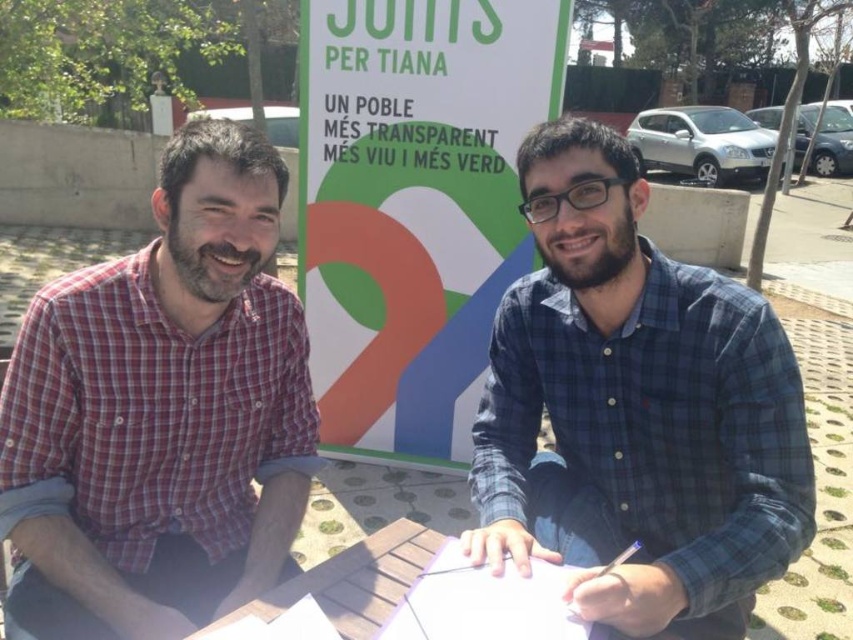
Which of these two, plaid cotton shirt at left or blue plaid shirt at center, stands taller?

Standing taller between the two is blue plaid shirt at center.

Is plaid cotton shirt at left thinner than blue plaid shirt at center?

Correct, plaid cotton shirt at left's width is less than blue plaid shirt at center's.

Does point (274, 307) come farther from viewer compared to point (764, 436)?

Yes, it is.

Identify the location of plaid cotton shirt at left. The height and width of the screenshot is (640, 853). (161, 413).

Does plaid cotton shirt at left have a lesser height compared to wooden picnic table at center?

In fact, plaid cotton shirt at left may be taller than wooden picnic table at center.

Does plaid cotton shirt at left have a larger size compared to wooden picnic table at center?

Indeed, plaid cotton shirt at left has a larger size compared to wooden picnic table at center.

Find the location of `plaid cotton shirt at left`. plaid cotton shirt at left is located at coordinates (161, 413).

Image resolution: width=853 pixels, height=640 pixels. What do you see at coordinates (635, 408) in the screenshot?
I see `blue plaid shirt at center` at bounding box center [635, 408].

Can you confirm if blue plaid shirt at center is thinner than green paper sign at center?

Yes.

Where is `blue plaid shirt at center`? blue plaid shirt at center is located at coordinates (635, 408).

I want to click on blue plaid shirt at center, so click(635, 408).